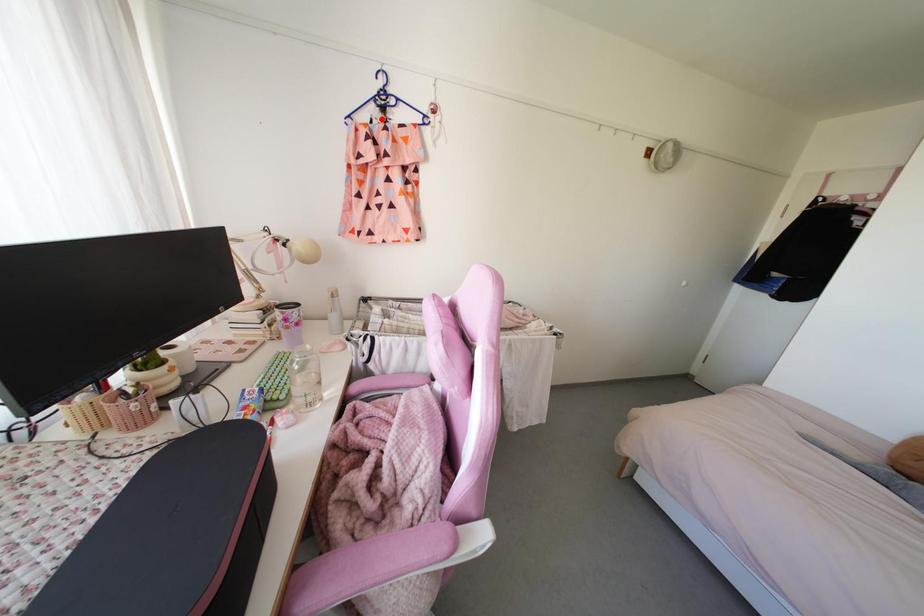
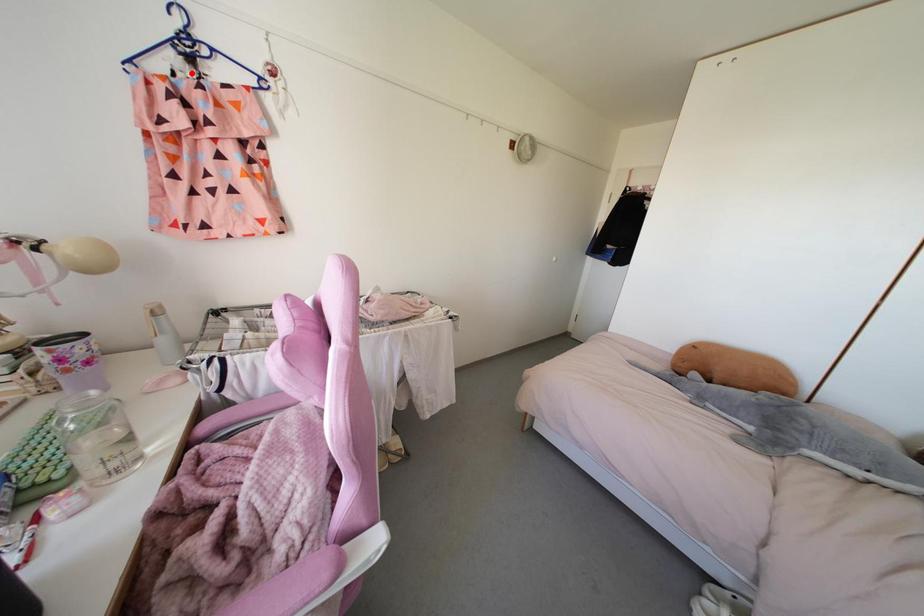
I am providing you with two images of the same scene from different viewpoints. A red point is marked on the first image and another point is marked on the second image. Is the marked point in image1 the same physical position as the marked point in image2?

Yes